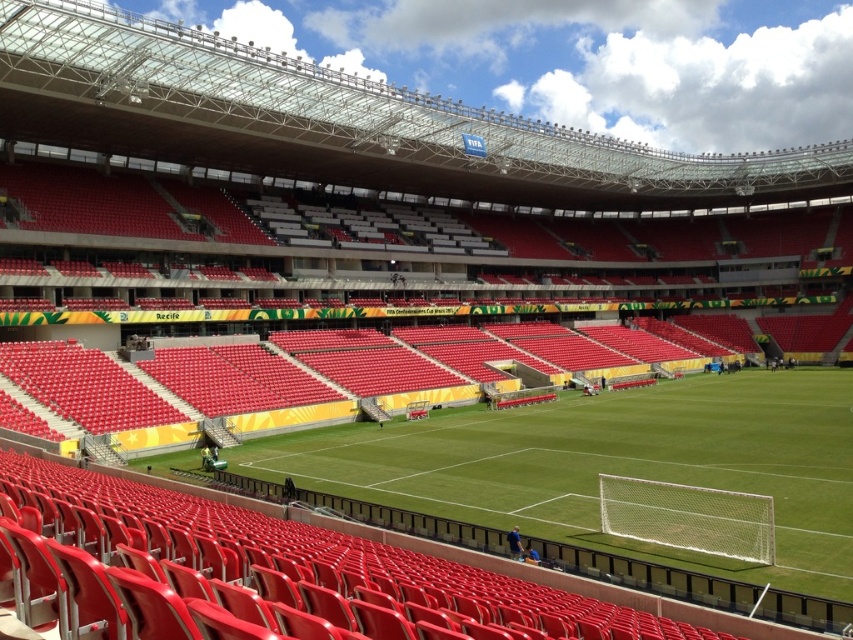
You are a spectator sitting in the stands and want to take a photo of both the green grass football field at center and the metallic silver cart at center. Which object should you zoom in on first to ensure both are in focus?

The green grass football field at center is much taller than the metallic silver cart at center, so you should zoom in on the metallic silver cart at center first to ensure both are in focus.

You are a photographer positioned at the edge of the soccer pitch. You need to capture a photo of both the white mesh net at lower right and the metallic silver cart at center without any obstructions. Based on their heights, which object might block the view of the other when framing the shot?

The metallic silver cart at center is taller than the white mesh net at lower right. Therefore, if positioned between the photographer and the net, the cart could potentially block the view of the net. However, since the net is at the lower right and the cart is at the center, their spatial arrangement might allow both to be visible depending on the angle. The height difference means the cart might obscure the net if they are aligned along the same axis.

You are standing at the entrance of the stadium and want to locate the green grass football field at center. According to the coordinates provided, where should you look to find it?

The green grass football field at center is located at the coordinates point 2D location at point (610, 465), so you should look towards the lower right direction from your current position at the entrance.